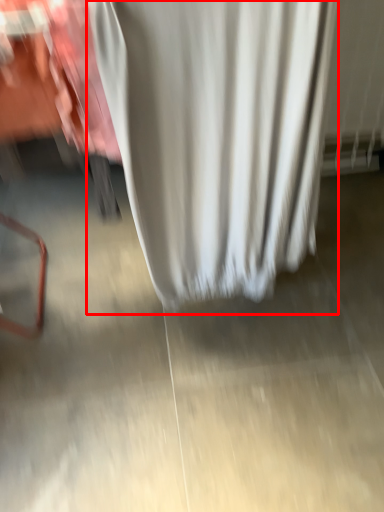
Question: From the image, what is the correct spatial relationship of curtain (annotated by the red box) in relation to concrete?

Choices:
 (A) right
 (B) left

Answer: (B)